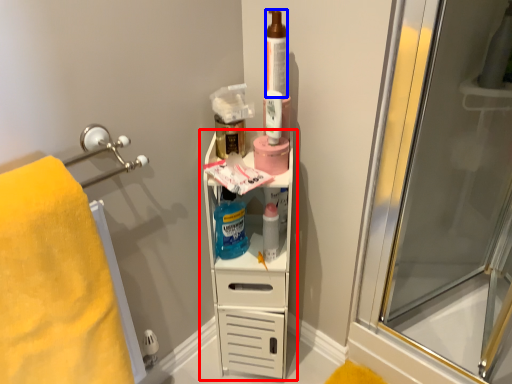
Question: Which object appears closest to the camera in this image, shelf (highlighted by a red box) or toiletry (highlighted by a blue box)?

Choices:
 (A) shelf
 (B) toiletry

Answer: (B)